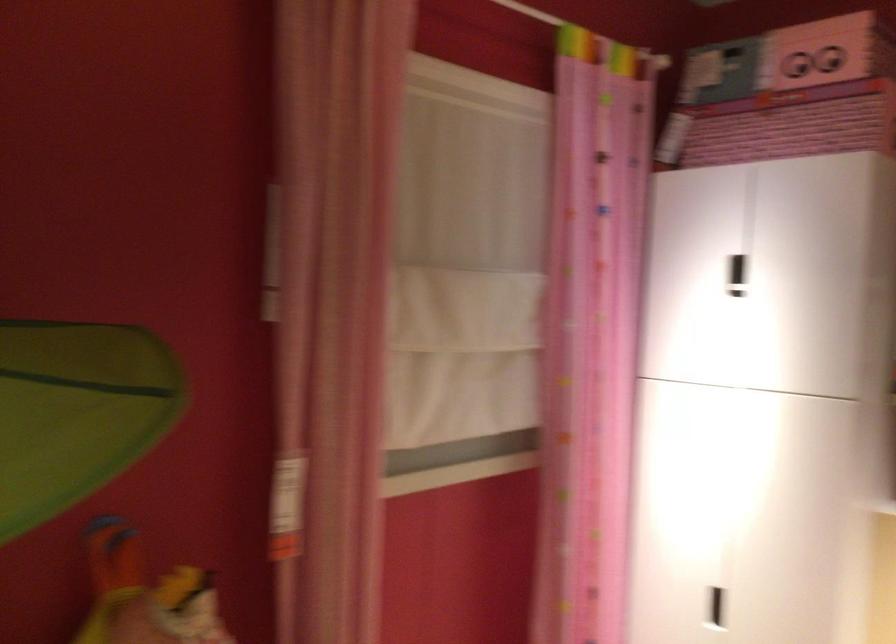
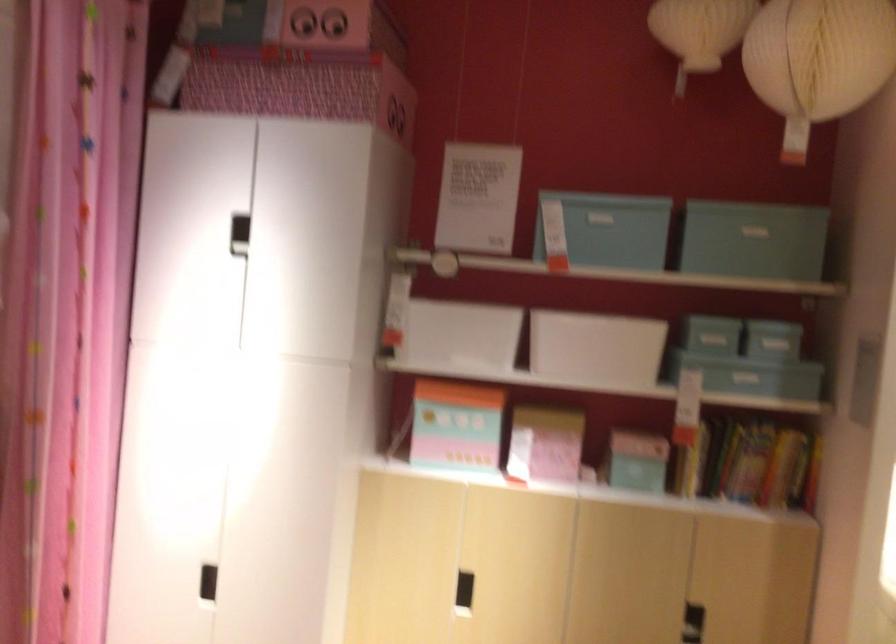
In the second image, find the point that corresponds to pixel 798 122 in the first image.

(300, 87)